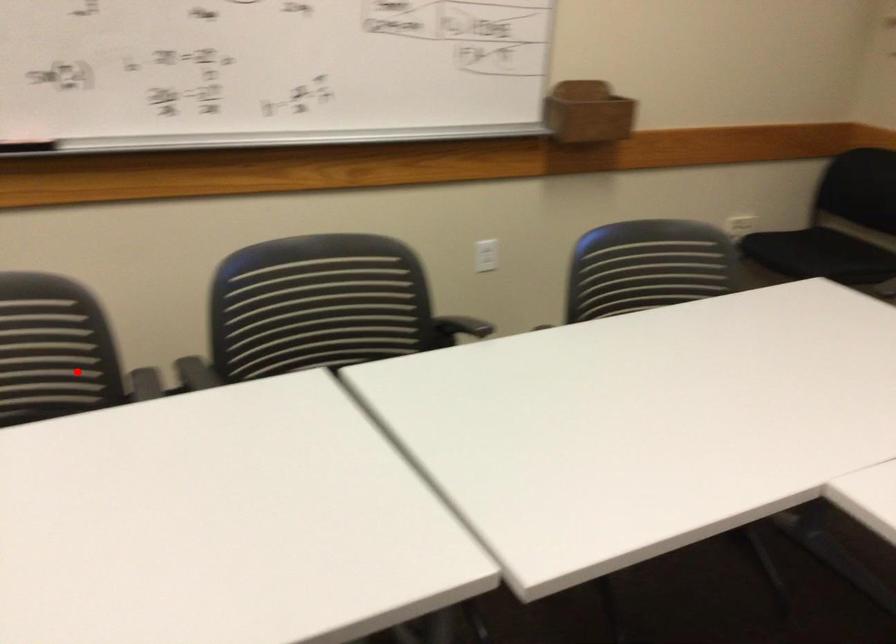
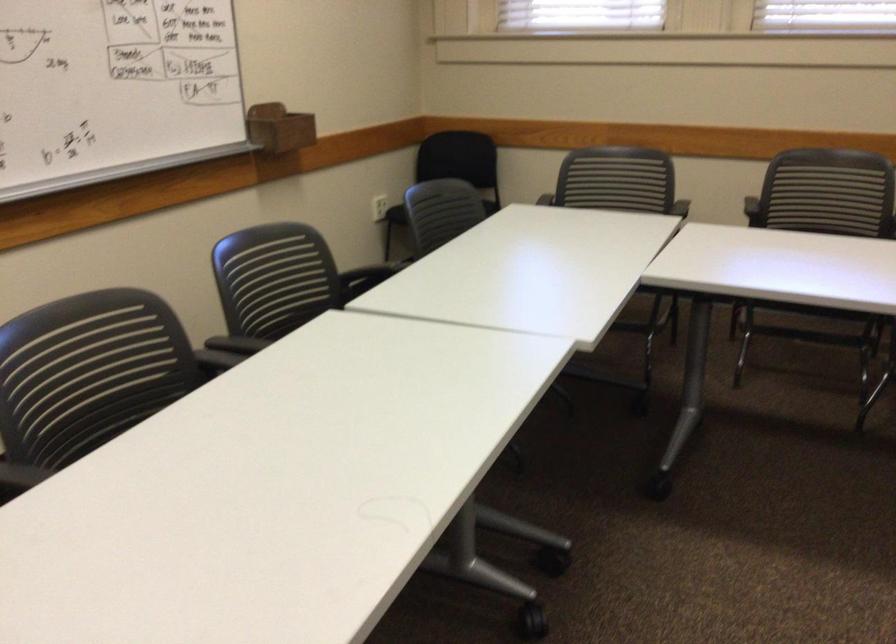
Question: I am providing you with two images of the same scene from different viewpoints. In image1, a red point is highlighted. Considering the same 3D point in image2, which of the following is correct?

Choices:
 (A) It is closer
 (B) It is farther

Answer: (B)